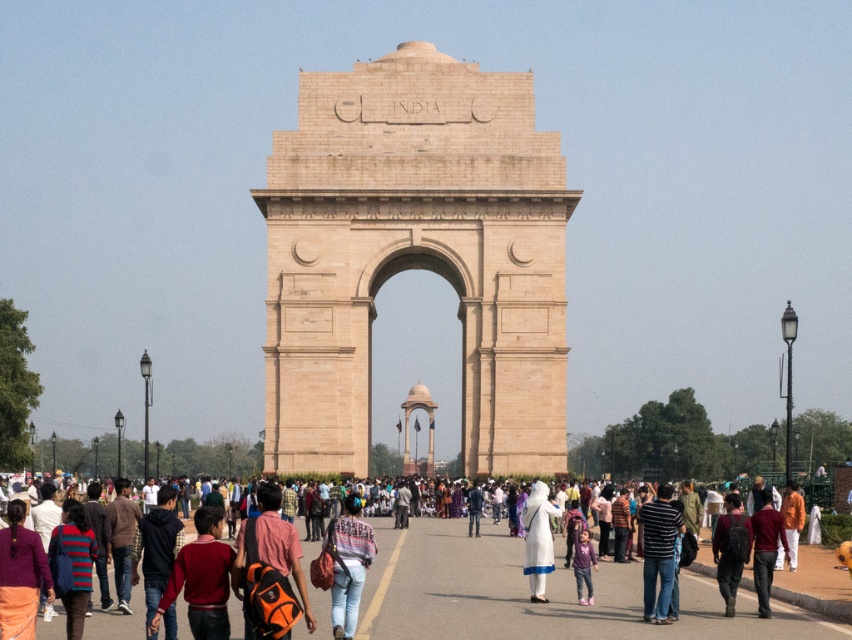
I want to click on denim jeans at center, so click(x=348, y=564).

Who is lower down, denim jeans at center or dark brown leather backpack at center?

dark brown leather backpack at center

What do you see at coordinates (348, 564) in the screenshot? Image resolution: width=852 pixels, height=640 pixels. I see `denim jeans at center` at bounding box center [348, 564].

Locate an element on the screen. denim jeans at center is located at coordinates (348, 564).

Which is more to the left, multicolored clothing at center or denim jeans at center?

denim jeans at center

Is point (584, 637) farther from viewer compared to point (344, 605)?

That is True.

Which is behind, point (753, 627) or point (337, 564)?

The point (753, 627) is more distant.

The height and width of the screenshot is (640, 852). What are the coordinates of `multicolored clothing at center` in the screenshot? It's located at (527, 593).

Who is taller, beige stone arch at center or dark brown leather backpack at center?

With more height is beige stone arch at center.

From the picture: Does beige stone arch at center have a smaller size compared to dark brown leather backpack at center?

Incorrect, beige stone arch at center is not smaller in size than dark brown leather backpack at center.

Where is `beige stone arch at center`? The width and height of the screenshot is (852, 640). beige stone arch at center is located at coordinates [x=415, y=257].